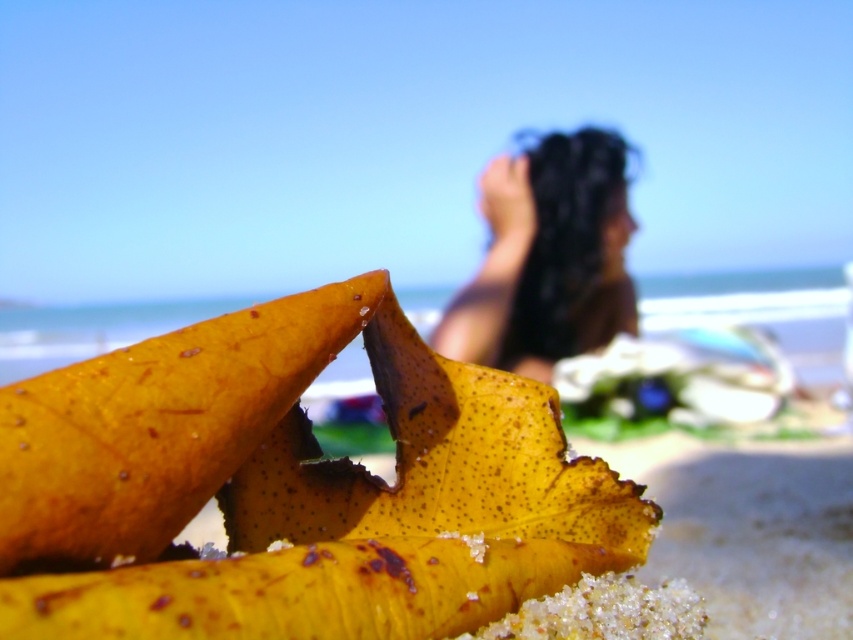
You are a beachgoer who wants to place a yellow papery banana at center on top of dark brown hair at upper center. Based on their sizes, will the banana fit without overlapping the edges?

The yellow papery banana at center is smaller than dark brown hair at upper center, so it should fit without overlapping the edges.

You are a photographer taking a picture of the beach scene. You notice the yellow papery banana at center and the dark brown hair at upper center. Which object is positioned lower in the image?

The yellow papery banana at center is located below dark brown hair at upper center, so it is positioned lower in the image.